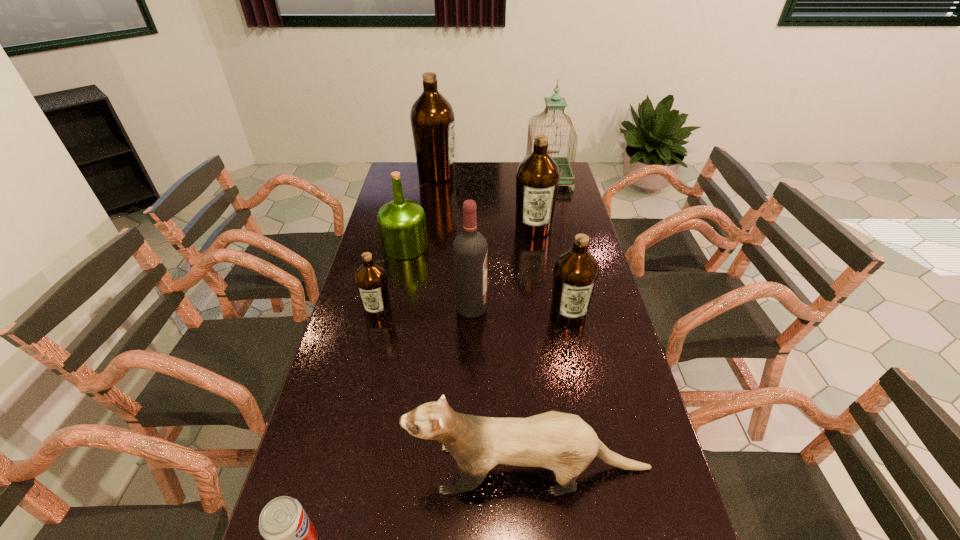
This screenshot has height=540, width=960. I want to click on the farthest olive oil, so click(432, 118).

At what (x,y) coordinates should I click in order to perform the action: click on the farthest brown olive oil. Please return your answer as a coordinate pair (x, y). Looking at the image, I should click on (432, 118).

Locate an element on the screen. This screenshot has height=540, width=960. birdcage is located at coordinates (555, 102).

The image size is (960, 540). I want to click on wine bottle, so click(x=470, y=250).

Image resolution: width=960 pixels, height=540 pixels. What are the coordinates of `the fourth shortest olive oil` in the screenshot? It's located at (537, 178).

Where is `the third nearest brown olive oil`? Image resolution: width=960 pixels, height=540 pixels. the third nearest brown olive oil is located at coordinates (537, 178).

Where is `green olive oil`? Image resolution: width=960 pixels, height=540 pixels. green olive oil is located at coordinates (401, 222).

Find the location of a particular element. the second smallest brown olive oil is located at coordinates (576, 271).

I want to click on gray ferret, so pos(564,443).

Identify the location of the second nearest object. (564, 443).